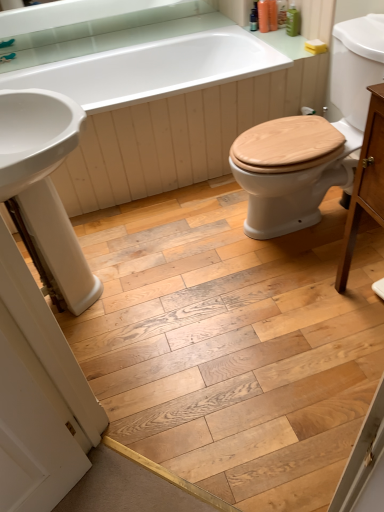
Where is `vacant space that is to the left of light brown wood cabinet at right`? This screenshot has height=512, width=384. vacant space that is to the left of light brown wood cabinet at right is located at coordinates (316, 327).